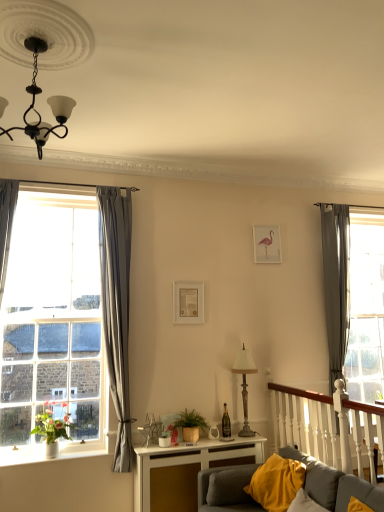
Question: Which direction should I rotate to look at pink paper picture frame at upper center, marked as the 1th picture frame in a top-to-bottom arrangement?

Choices:
 (A) left
 (B) right

Answer: (B)

Question: Can you confirm if clear glass window at left is bigger than transparent glass door at right?

Choices:
 (A) yes
 (B) no

Answer: (A)

Question: Does clear glass window at left appear on the left side of transparent glass door at right?

Choices:
 (A) yes
 (B) no

Answer: (A)

Question: From the image's perspective, is clear glass window at left beneath transparent glass door at right?

Choices:
 (A) no
 (B) yes

Answer: (A)

Question: From a real-world perspective, is clear glass window at left positioned over transparent glass door at right based on gravity?

Choices:
 (A) yes
 (B) no

Answer: (B)

Question: From a real-world perspective, is clear glass window at left physically below transparent glass door at right?

Choices:
 (A) no
 (B) yes

Answer: (B)

Question: Is clear glass window at left completely or partially outside of transparent glass door at right?

Choices:
 (A) no
 (B) yes

Answer: (B)

Question: Is white glossy table at lower center not close to black matte chandelier at upper left?

Choices:
 (A) yes
 (B) no

Answer: (A)

Question: From the image's perspective, is white glossy table at lower center on black matte chandelier at upper left?

Choices:
 (A) yes
 (B) no

Answer: (B)

Question: Does white glossy table at lower center have a lesser width compared to black matte chandelier at upper left?

Choices:
 (A) no
 (B) yes

Answer: (B)

Question: From a real-world perspective, is white glossy table at lower center positioned over black matte chandelier at upper left based on gravity?

Choices:
 (A) yes
 (B) no

Answer: (B)

Question: Considering the relative sizes of white glossy table at lower center and black matte chandelier at upper left in the image provided, is white glossy table at lower center taller than black matte chandelier at upper left?

Choices:
 (A) no
 (B) yes

Answer: (B)

Question: Is white glossy table at lower center outside of black matte chandelier at upper left?

Choices:
 (A) no
 (B) yes

Answer: (B)

Question: Does matte gold picture frame at center, positioned as the second picture frame in right-to-left order, have a smaller size compared to yellow fabric pillow at lower right?

Choices:
 (A) no
 (B) yes

Answer: (B)